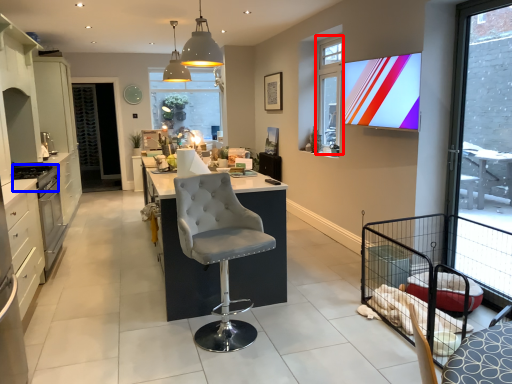
Question: Which object is further to the camera taking this photo, window (highlighted by a red box) or appliance (highlighted by a blue box)?

Choices:
 (A) window
 (B) appliance

Answer: (A)